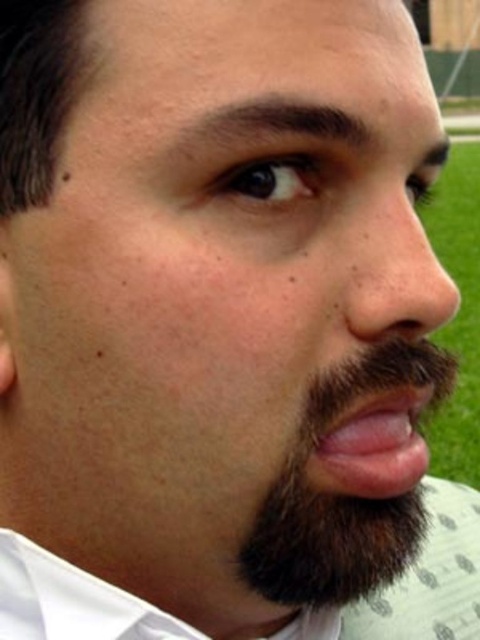
Consider the image. How far apart are brown fuzzy beard at center and pink flesh at center?

A distance of 0.83 inches exists between brown fuzzy beard at center and pink flesh at center.

Is brown fuzzy beard at center below pink flesh at center?

Yes, brown fuzzy beard at center is below pink flesh at center.

Between point (305, 509) and point (331, 426), which one is positioned in front?

Point (331, 426)

I want to click on brown fuzzy beard at center, so (x=343, y=493).